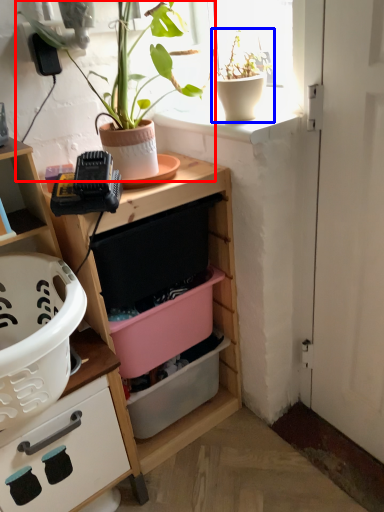
Question: Which of the following is the closest to the observer, houseplant (highlighted by a red box) or houseplant (highlighted by a blue box)?

Choices:
 (A) houseplant
 (B) houseplant

Answer: (A)